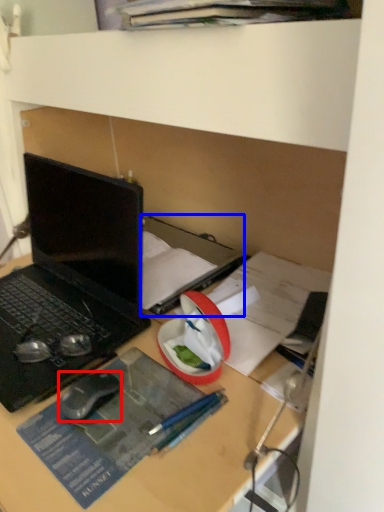
Question: Which object appears farthest to the camera in this image, mouse (highlighted by a red box) or book (highlighted by a blue box)?

Choices:
 (A) mouse
 (B) book

Answer: (B)